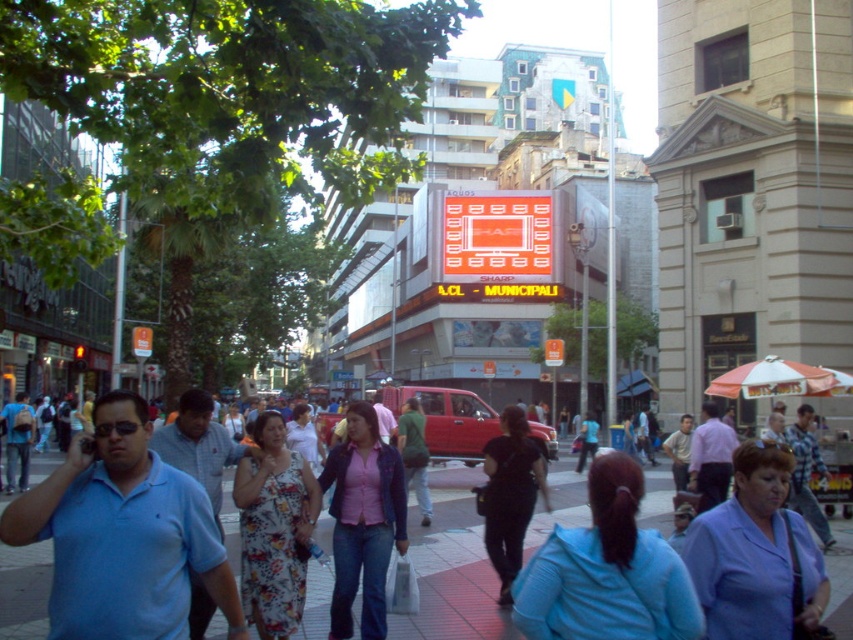
You are a delivery person standing at the blue cotton polo shirt at left position. You need to deliver a package to the smooth concrete sidewalk at center. The delivery robot you use has a maximum travel distance of 50 feet. Can the robot reach the destination?

The blue cotton polo shirt at left is 56.12 feet away from the smooth concrete sidewalk at center. Since the robot can only travel 50 feet, it cannot reach the destination.

You are a delivery person carrying a large box that is 1.5 meters wide. You need to walk through the area shown in the image. Can you pass between the blue cotton polo shirt at left and the smooth concrete sidewalk at center without the box touching either? Please explain your reasoning.

The blue cotton polo shirt at left is narrower than the smooth concrete sidewalk at center. Since the box is 1.5 meters wide, and the space between them allows for passage as long as the box doesn